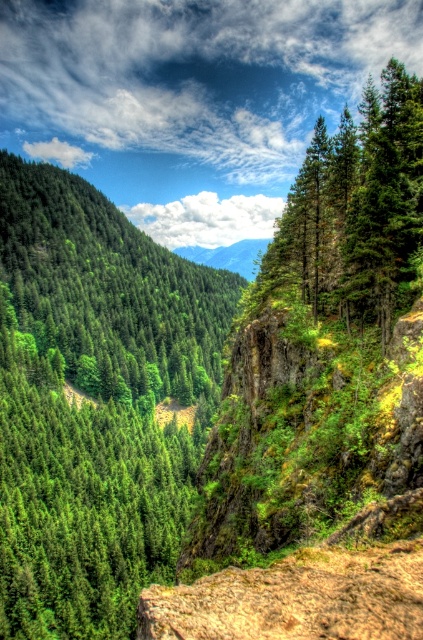
Who is taller, green matte tree at left or green matte tree at upper right?

green matte tree at upper right is taller.

Does green matte tree at left have a greater height compared to green matte tree at upper right?

Incorrect, green matte tree at left's height is not larger of green matte tree at upper right's.

Which is in front, point (192, 273) or point (398, 300)?

Point (398, 300)

I want to click on green matte tree at left, so click(x=107, y=289).

Can you confirm if green matte tree at left is positioned to the left of green textured mountain at center?

Indeed, green matte tree at left is positioned on the left side of green textured mountain at center.

Is green matte tree at left to the right of green textured mountain at center from the viewer's perspective?

Incorrect, green matte tree at left is not on the right side of green textured mountain at center.

Does point (60, 316) come in front of point (244, 257)?

Yes, point (60, 316) is closer to viewer.

Where is `green matte tree at left`? green matte tree at left is located at coordinates (107, 289).

Which is below, green matte tree at upper right or green textured mountain at center?

green textured mountain at center

Can you confirm if green matte tree at upper right is bigger than green textured mountain at center?

Yes.

Which is behind, point (340, 115) or point (195, 244)?

The point (340, 115) is more distant.

Where is `green matte tree at upper right`? The image size is (423, 640). green matte tree at upper right is located at coordinates (354, 211).